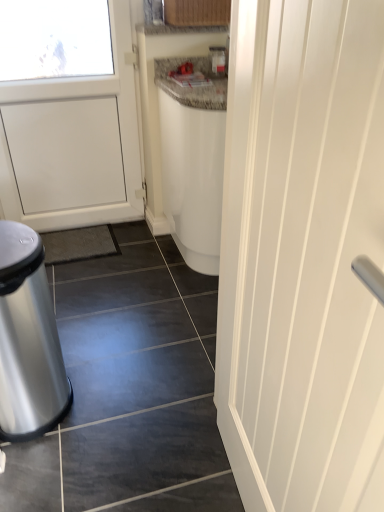
Question: Is white smooth door at right bigger or smaller than polished metallic trash can at lower left?

Choices:
 (A) big
 (B) small

Answer: (A)

Question: Looking at their shapes, would you say white smooth door at right is wider or thinner than polished metallic trash can at lower left?

Choices:
 (A) wide
 (B) thin

Answer: (B)

Question: From their relative heights in the image, would you say white smooth door at right is taller or shorter than polished metallic trash can at lower left?

Choices:
 (A) tall
 (B) short

Answer: (A)

Question: Considering the positions of polished metallic trash can at lower left and white smooth door at right in the image, is polished metallic trash can at lower left wider or thinner than white smooth door at right?

Choices:
 (A) thin
 (B) wide

Answer: (B)

Question: Is polished metallic trash can at lower left inside or outside of white smooth door at right?

Choices:
 (A) inside
 (B) outside

Answer: (B)

Question: Relative to white smooth door at right, is polished metallic trash can at lower left in front or behind?

Choices:
 (A) behind
 (B) front

Answer: (A)

Question: Is point (26, 266) positioned closer to the camera than point (365, 28)?

Choices:
 (A) farther
 (B) closer

Answer: (A)